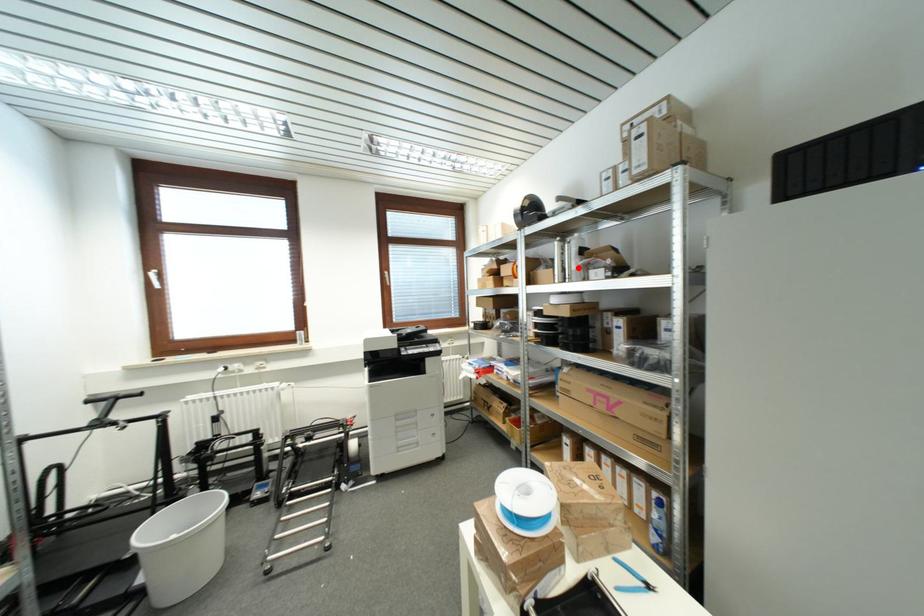
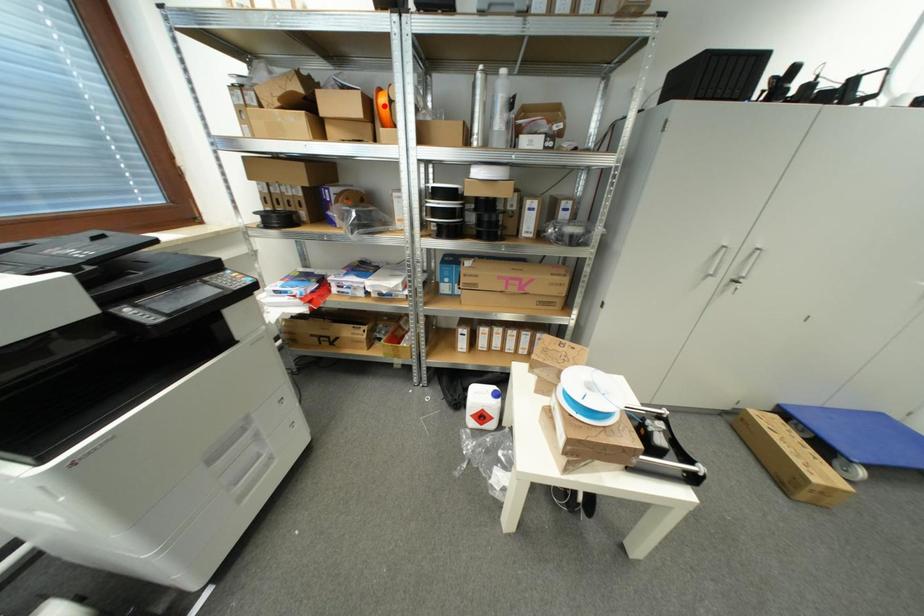
I am providing you with two images of the same scene from different viewpoints. A red point is marked on the first image and another point is marked on the second image. Do the highlighted points in image1 and image2 indicate the same real-world spot?

No